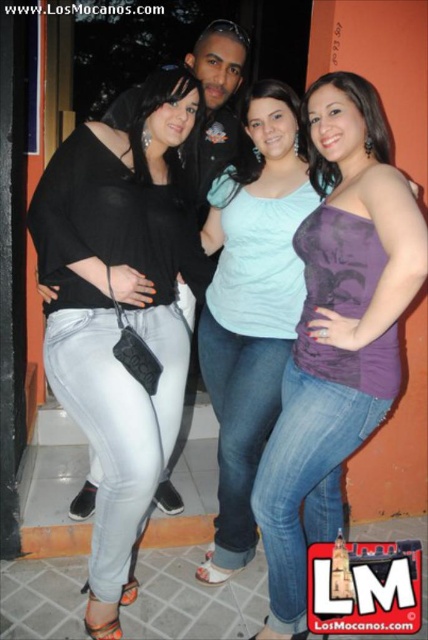
You are a photographer trying to adjust the lighting for a photo shoot. You notice two tops in the scene, the black matte top at left and the purple matte tank top at center. Which top should you focus your lighting on if you want to highlight the larger one?

The black matte top at left is bigger than the purple matte tank top at center, so you should focus the lighting on the black matte top at left to highlight its larger size.

Based on the photo, you are a photographer trying to capture a group photo. You notice two people in the group wearing a black matte top at left and a purple matte tank top at center. Based on their clothing sizes, which person might require a wider space to accommodate their outfit?

The black matte top at left has a larger width than the purple matte tank top at center, so the person wearing the black matte top at left would need a wider space to accommodate their outfit.